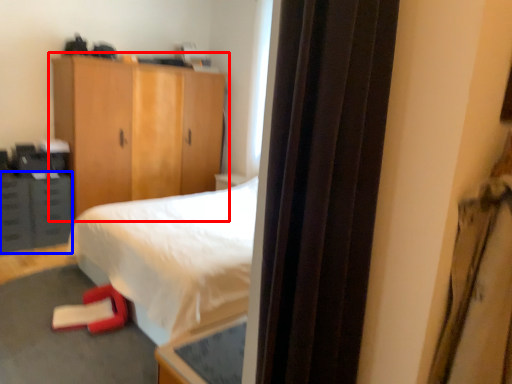
Question: Among these objects, which one is farthest to the camera, cupboard (highlighted by a red box) or cabinetry (highlighted by a blue box)?

Choices:
 (A) cupboard
 (B) cabinetry

Answer: (B)